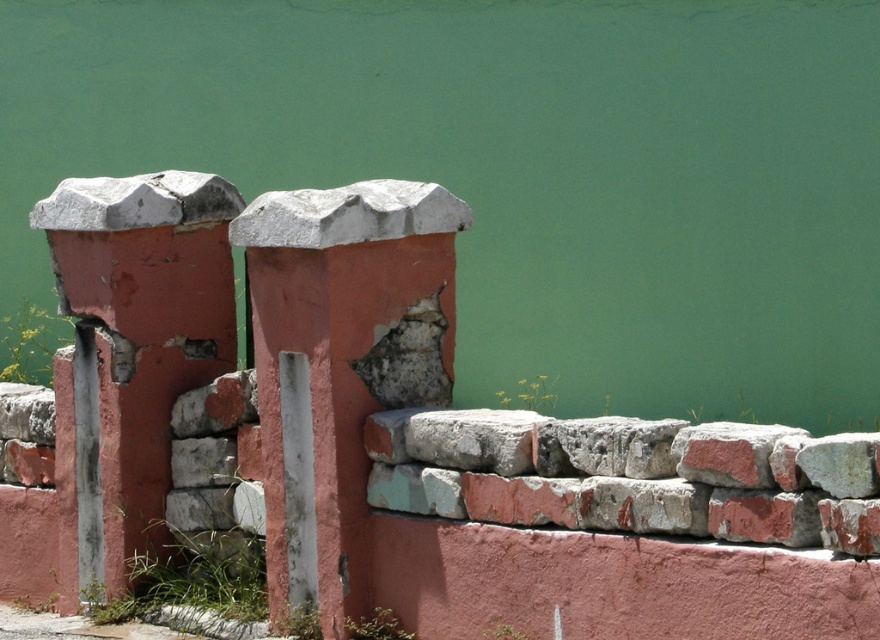
Question: Considering the relative positions of rusty stone brick at lower right and rusty brick stone at center in the image provided, where is rusty stone brick at lower right located with respect to rusty brick stone at center?

Choices:
 (A) left
 (B) right

Answer: (B)

Question: Among these points, which one is nearest to the camera?

Choices:
 (A) (324, 596)
 (B) (159, 483)
 (C) (242, 420)

Answer: (A)

Question: Does rusty stone brick at lower right appear under rusty brick stone at center?

Choices:
 (A) no
 (B) yes

Answer: (B)

Question: Which is nearer to the rusty concrete pillar at left?

Choices:
 (A) rusty concrete pillar at center
 (B) rusty brick stone at center
 (C) rusty stone brick at lower right

Answer: (B)

Question: Which of these objects is positioned closest to the rusty concrete pillar at center?

Choices:
 (A) rusty brick stone at center
 (B) rusty stone brick at lower right
 (C) rusty concrete pillar at left

Answer: (A)

Question: Can you confirm if rusty concrete pillar at left is bigger than rusty stone brick at lower right?

Choices:
 (A) no
 (B) yes

Answer: (B)